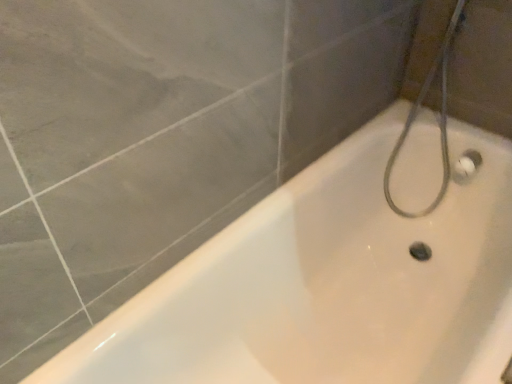
Question: In the image, is white rubber hose at upper right positioned in front of or behind white glossy bathtub at center?

Choices:
 (A) front
 (B) behind

Answer: (B)

Question: From the image's perspective, is white rubber hose at upper right above or below white glossy bathtub at center?

Choices:
 (A) below
 (B) above

Answer: (B)

Question: Looking at their shapes, would you say white rubber hose at upper right is wider or thinner than white glossy bathtub at center?

Choices:
 (A) wide
 (B) thin

Answer: (B)

Question: Relative to white rubber hose at upper right, is white glossy bathtub at center in front or behind?

Choices:
 (A) behind
 (B) front

Answer: (B)

Question: From a real-world perspective, is white glossy bathtub at center above or below white rubber hose at upper right?

Choices:
 (A) below
 (B) above

Answer: (A)

Question: Is white glossy bathtub at center inside the boundaries of white rubber hose at upper right, or outside?

Choices:
 (A) inside
 (B) outside

Answer: (B)

Question: In terms of width, does white glossy bathtub at center look wider or thinner when compared to white rubber hose at upper right?

Choices:
 (A) thin
 (B) wide

Answer: (B)